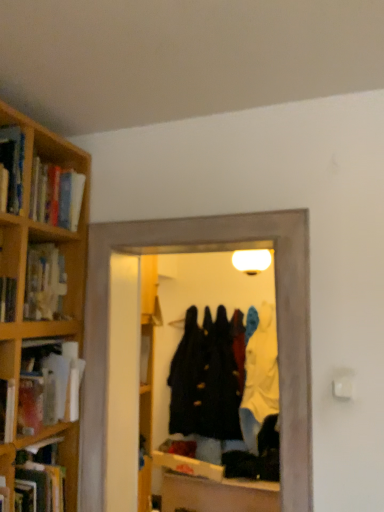
Question: Should I look upward or downward to see velvet black coat at center, arranged as the 2th clothing when viewed from the right?

Choices:
 (A) down
 (B) up

Answer: (A)

Question: Should I look upward or downward to see hardcover book at left, which is counted as the first book, starting from the bottom?

Choices:
 (A) down
 (B) up

Answer: (A)

Question: Can you confirm if wooden bookshelf at left is shorter than matte cardboard book at left, which appears as the second book when ordered from the bottom?

Choices:
 (A) no
 (B) yes

Answer: (B)

Question: From a real-world perspective, is wooden bookshelf at left located higher than matte cardboard book at left, which appears as the second book when ordered from the bottom?

Choices:
 (A) no
 (B) yes

Answer: (B)

Question: Is wooden bookshelf at left in contact with matte cardboard book at left, which is counted as the 1th book, starting from the top?

Choices:
 (A) no
 (B) yes

Answer: (A)

Question: Does wooden bookshelf at left have a larger size compared to matte cardboard book at left, which appears as the second book when ordered from the bottom?

Choices:
 (A) no
 (B) yes

Answer: (A)

Question: Is wooden bookshelf at left looking in the opposite direction of matte cardboard book at left, which is counted as the 1th book, starting from the top?

Choices:
 (A) no
 (B) yes

Answer: (A)

Question: Can you confirm if wooden bookshelf at left is smaller than matte cardboard book at left, which appears as the second book when ordered from the bottom?

Choices:
 (A) no
 (B) yes

Answer: (B)

Question: Does velvet black coat at center, arranged as the 2th clothing when viewed from the right, have a smaller size compared to matte cardboard book at left, which is counted as the 1th book, starting from the top?

Choices:
 (A) no
 (B) yes

Answer: (A)

Question: Considering the relative sizes of velvet black coat at center, which is counted as the 1th clothing, starting from the left, and matte cardboard book at left, which appears as the second book when ordered from the bottom, in the image provided, is velvet black coat at center, which is counted as the 1th clothing, starting from the left, wider than matte cardboard book at left, which appears as the second book when ordered from the bottom,?

Choices:
 (A) yes
 (B) no

Answer: (A)

Question: Does velvet black coat at center, arranged as the 2th clothing when viewed from the right, lie behind matte cardboard book at left, which is counted as the 1th book, starting from the top?

Choices:
 (A) no
 (B) yes

Answer: (B)

Question: Is velvet black coat at center, arranged as the 2th clothing when viewed from the right, positioned beyond the bounds of matte cardboard book at left, which appears as the second book when ordered from the bottom?

Choices:
 (A) yes
 (B) no

Answer: (A)

Question: Does velvet black coat at center, arranged as the 2th clothing when viewed from the right, have a greater height compared to matte cardboard book at left, which appears as the second book when ordered from the bottom?

Choices:
 (A) yes
 (B) no

Answer: (A)

Question: From the image's perspective, is velvet black coat at center, arranged as the 2th clothing when viewed from the right, located above matte cardboard book at left, which appears as the second book when ordered from the bottom?

Choices:
 (A) no
 (B) yes

Answer: (A)

Question: Is matte cardboard book at left, which appears as the second book when ordered from the bottom, at the left side of velvet black coat at center, arranged as the 2th clothing when viewed from the right?

Choices:
 (A) yes
 (B) no

Answer: (A)